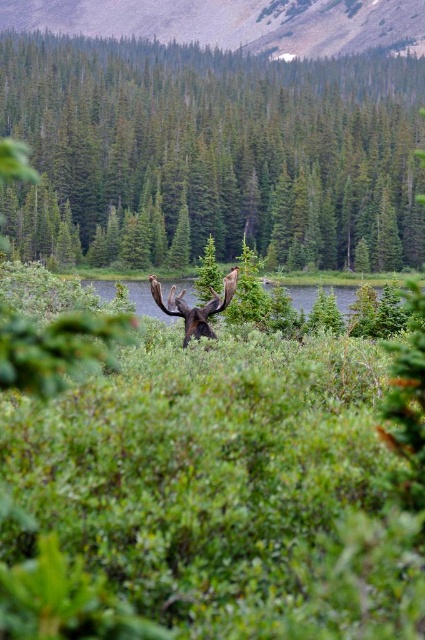
Can you confirm if rugged brown mountain at upper center is positioned to the right of brown furry moose at center?

No, rugged brown mountain at upper center is not to the right of brown furry moose at center.

The width and height of the screenshot is (425, 640). What do you see at coordinates (234, 22) in the screenshot?
I see `rugged brown mountain at upper center` at bounding box center [234, 22].

Does point (184, 4) come farther from viewer compared to point (164, 308)?

Yes.

Where is `rugged brown mountain at upper center`? This screenshot has height=640, width=425. rugged brown mountain at upper center is located at coordinates (234, 22).

Is rugged brown mountain at upper center shorter than green grassy lake at center?

No.

Can you confirm if rugged brown mountain at upper center is positioned to the left of green grassy lake at center?

Indeed, rugged brown mountain at upper center is positioned on the left side of green grassy lake at center.

Measure the distance between point [246,12] and camera.

The distance of point [246,12] from camera is 269.71 meters.

Where is `rugged brown mountain at upper center`? This screenshot has height=640, width=425. rugged brown mountain at upper center is located at coordinates (234, 22).

Is green leafy tree at center positioned in front of green grassy lake at center?

No, it is not.

Is point (62, 84) positioned behind point (141, 289)?

Yes.

Who is more distant from viewer, (241, 220) or (113, 284)?

The point (241, 220) is more distant.

Where is `green leafy tree at center`? The image size is (425, 640). green leafy tree at center is located at coordinates (224, 141).